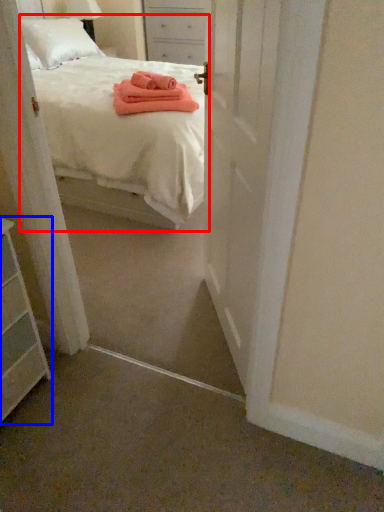
Question: Which of the following is the closest to the observer, bed (highlighted by a red box) or chest of drawers (highlighted by a blue box)?

Choices:
 (A) bed
 (B) chest of drawers

Answer: (B)